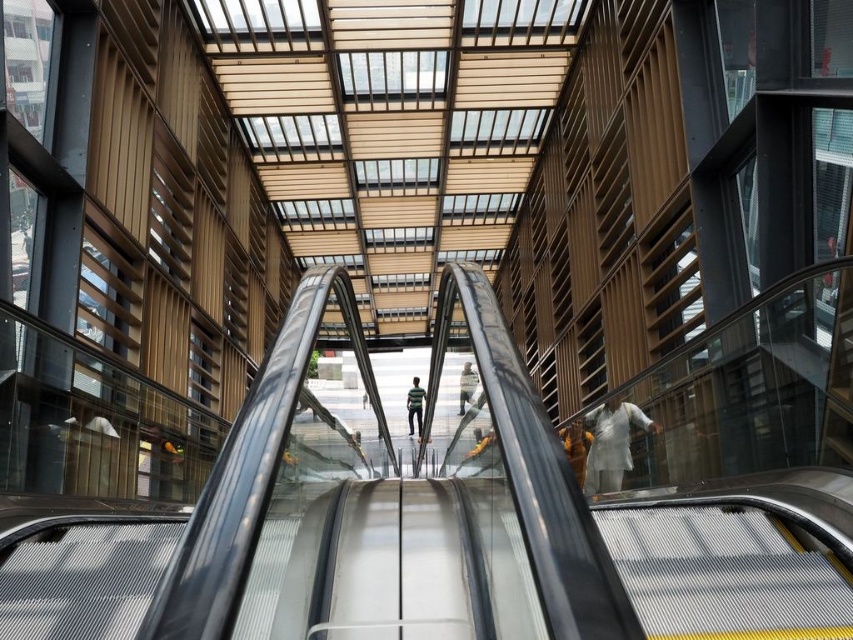
Based on the photo, you are standing at the bottom of the escalator and see two items on the steps ahead of you. The striped shirt at center and the light brown leather jacket at center. Which item is closer to you?

The striped shirt at center is below the light brown leather jacket at center, so the striped shirt at center is closer to you.

You are a delivery robot with a height of 1.5 meters. You need to move from the bottom of the escalator to the top. There are two obstacles in your path at the center of the escalator area, a striped shirt at center and a light brown leather jacket at center. What is the minimum height you need to be to safely pass between them without touching either?

The distance between the striped shirt at center and the light brown leather jacket at center is 18.02 meters. Since the distance is more than sufficient for the robot to pass through without needing to adjust its height, the minimum height required is 1.5 meters, which is the robot height.

You are standing at the bottom of the escalator and see a white cloth at right and a light brown leather jacket at center. Which item is positioned more to the right side?

The white cloth at right is positioned more to the right side than the light brown leather jacket at center.